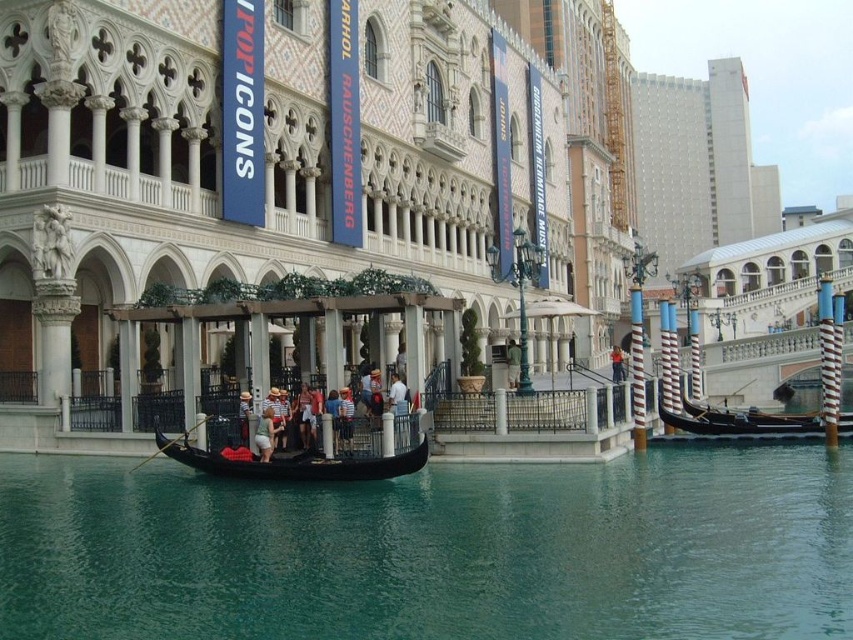
Question: Is the position of teal glossy water at center more distant than that of black polished wood gondola at right?

Choices:
 (A) yes
 (B) no

Answer: (B)

Question: Does light green fabric shirt at center have a larger size compared to light blue denim jeans at center?

Choices:
 (A) no
 (B) yes

Answer: (A)

Question: Which is nearer to the matte black gondola at lower center?

Choices:
 (A) black polished wood gondola at right
 (B) teal glossy water at center
 (C) light green fabric shirt at center
 (D) light blue denim jeans at center

Answer: (B)

Question: Can you confirm if matte black gondola at lower center is thinner than teal glossy water at center?

Choices:
 (A) yes
 (B) no

Answer: (B)

Question: Which point is closer to the camera?

Choices:
 (A) (274, 429)
 (B) (618, 349)
 (C) (264, 88)
 (D) (697, 476)

Answer: (A)

Question: Which object is positioned closest to the light green fabric shirt at center?

Choices:
 (A) matte black gondola at lower center
 (B) black polished wood gondola at right

Answer: (B)